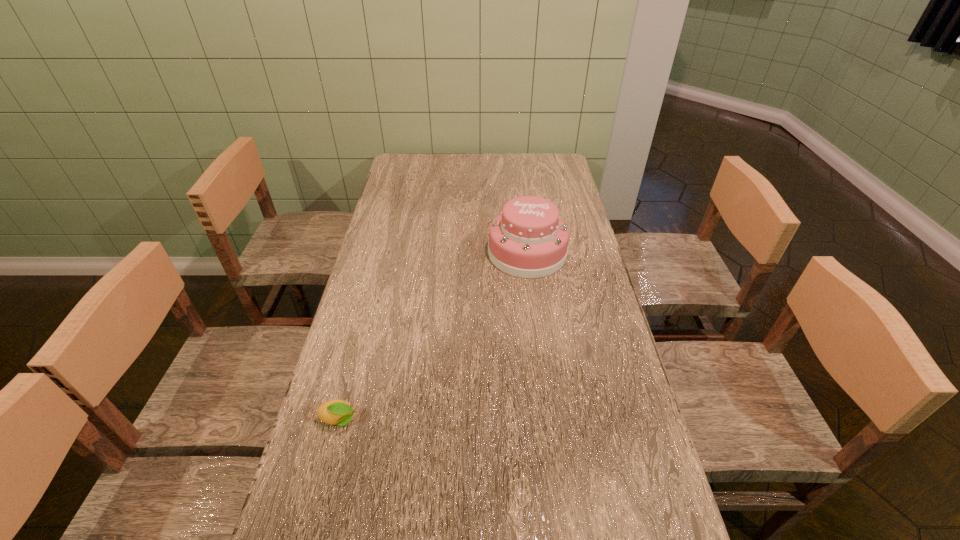
Find the location of `the taller object`. the taller object is located at coordinates (528, 239).

Where is `the right object`? This screenshot has height=540, width=960. the right object is located at coordinates (528, 239).

You are a GUI agent. You are given a task and a screenshot of the screen. Output one action in this format:
    pyautogui.click(x=<x>, y=<y>)
    Task: Click on the left object
    Image resolution: width=960 pixels, height=540 pixels.
    Given the screenshot: What is the action you would take?
    pyautogui.click(x=336, y=412)

Where is `lemon`? This screenshot has width=960, height=540. lemon is located at coordinates pyautogui.click(x=336, y=412).

Identify the location of free space located on the back of the right object. (519, 191).

Identify the location of free space located 0.250m with leaves positioned above the lemon. (468, 420).

Where is `object present at the left edge`? object present at the left edge is located at coordinates (336, 412).

The image size is (960, 540). Identify the location of object situated at the right edge. (528, 239).

In the image, there is a desktop. Find the location of `vacant region at the far edge`. vacant region at the far edge is located at coordinates (470, 180).

Where is `free region at the left edge`? This screenshot has width=960, height=540. free region at the left edge is located at coordinates (404, 302).